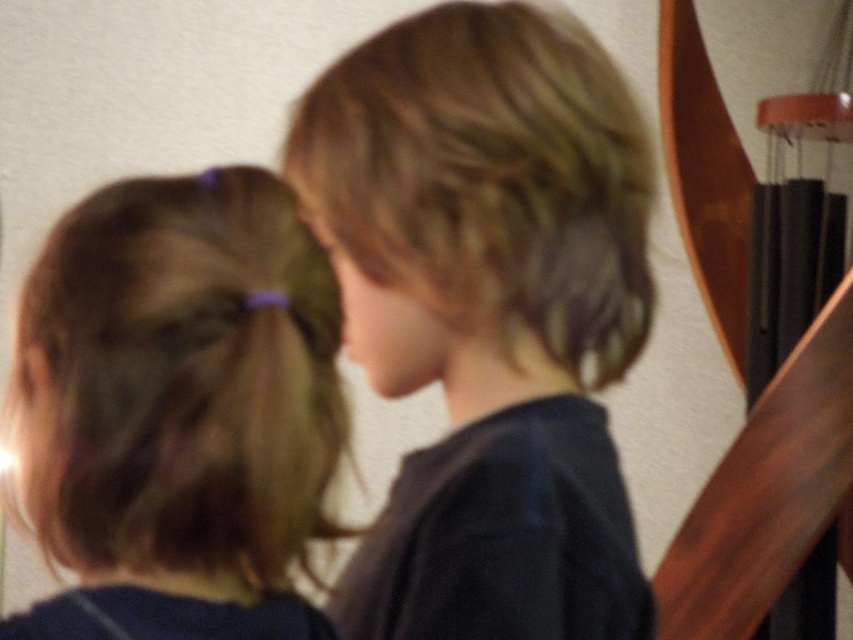
Between blonde hair at center and brown hair at left, which one is positioned higher?

Positioned higher is blonde hair at center.

This screenshot has height=640, width=853. In order to click on blonde hair at center in this screenshot , I will do `click(488, 314)`.